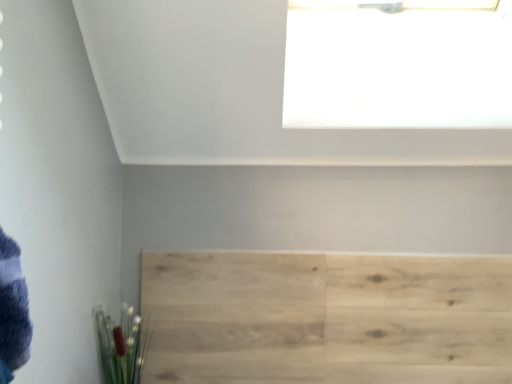
Find the location of a particular element. This screenshot has width=512, height=384. free space above light wood drawer at lower center (from a real-world perspective) is located at coordinates (320, 246).